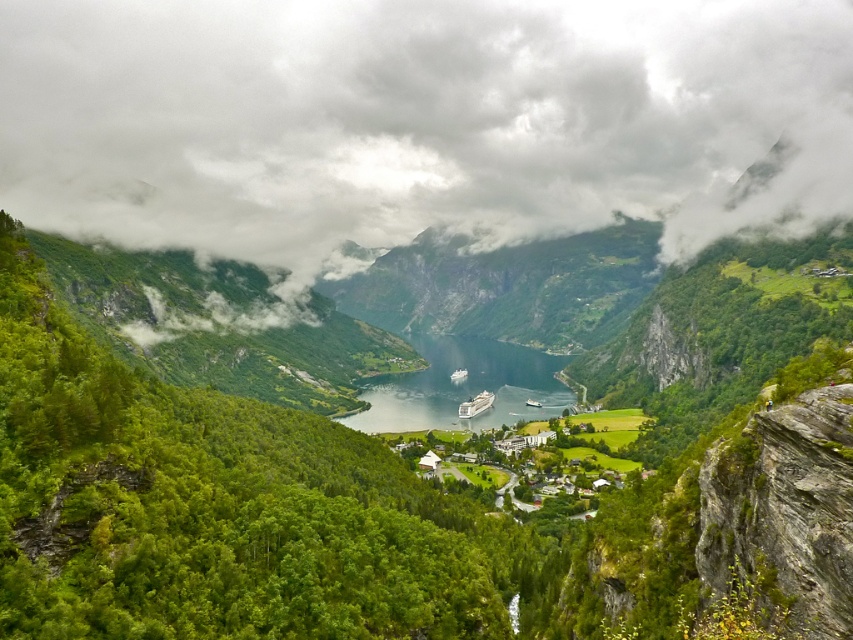
From the picture: You are a photographer planning to capture the fjord landscape. You want to ensure that both the clear blue water at center and the white glossy cruise ship at center are visible in your shot. Based on their positions, which object should you frame first to include both in the composition?

The clear blue water at center is positioned on the left side of the white glossy cruise ship at center. To include both in the composition, you should frame the clear blue water at center first as it is on the left, ensuring there is enough space for the white glossy cruise ship at center on the right.

You are a photographer planning to capture the fjord landscape. You notice the cloudy sky at center and the white glossy cruise ship at center. Which object is positioned higher in the frame?

The cloudy sky at center is located above the white glossy cruise ship at center, so it is positioned higher in the frame.

You are standing on the dock and looking at the cloudy sky at center and the white glossy cruise ship at center. Which object is closer to you?

The cloudy sky at center is closer to you because the white glossy cruise ship at center is behind it.